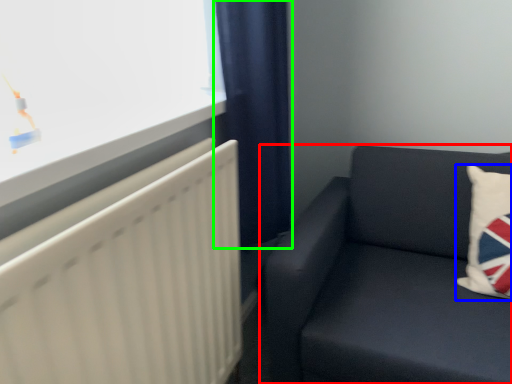
Question: Which object is the closest to the studio couch (highlighted by a red box)? Choose among these: pillow (highlighted by a blue box) or curtain (highlighted by a green box).

Choices:
 (A) pillow
 (B) curtain

Answer: (A)